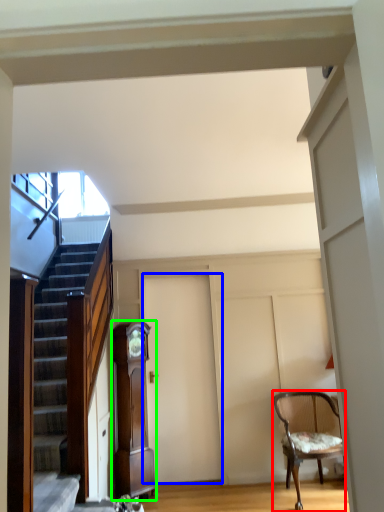
Question: Which object is positioned farthest from chair (highlighted by a red box)? Select from door (highlighted by a blue box) and cabinetry (highlighted by a green box).

Choices:
 (A) door
 (B) cabinetry

Answer: (B)